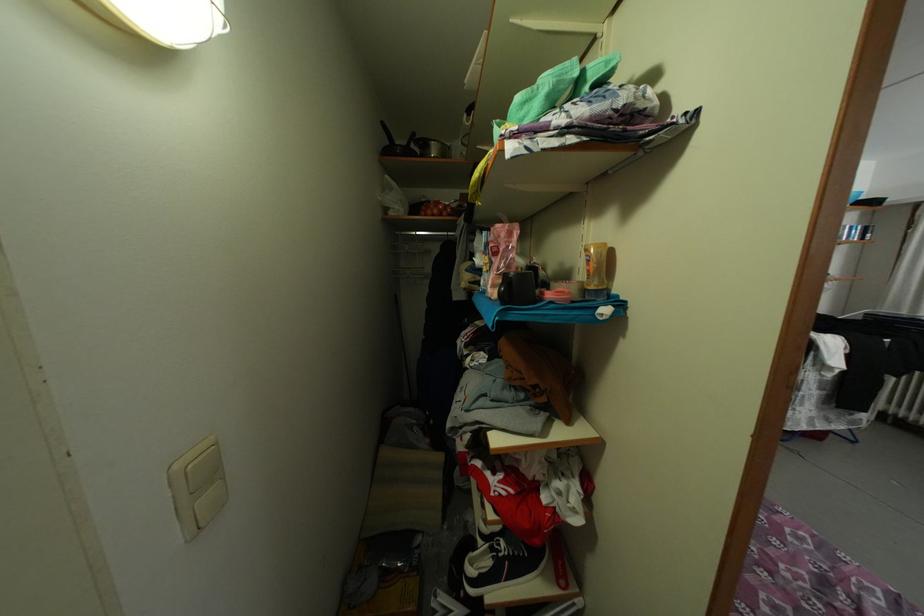
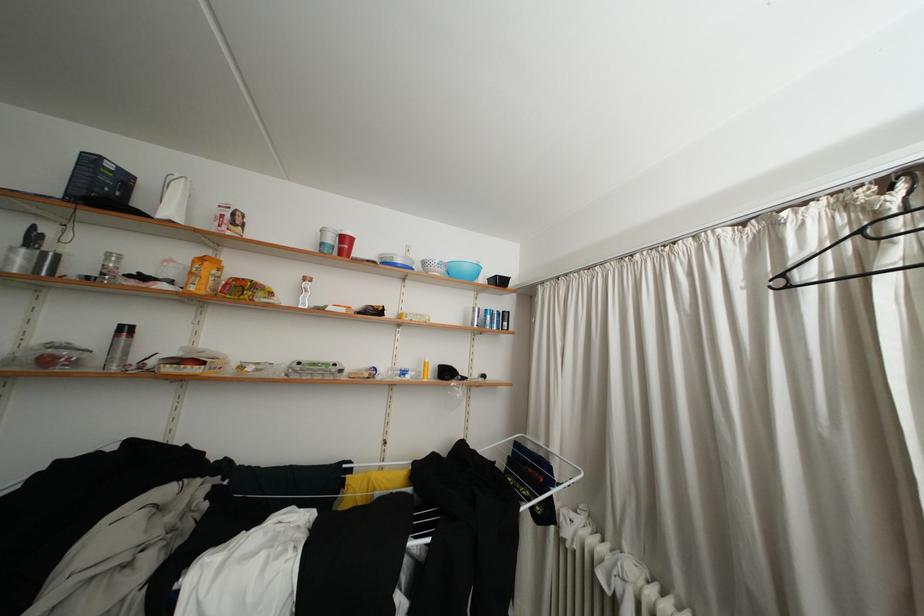
Question: Which direction would the cameraman need to move to produce the second image? Reply with the corresponding letter.

Choices:
 (A) Left
 (B) Right
 (C) Forward
 (D) Backward

Answer: (B)